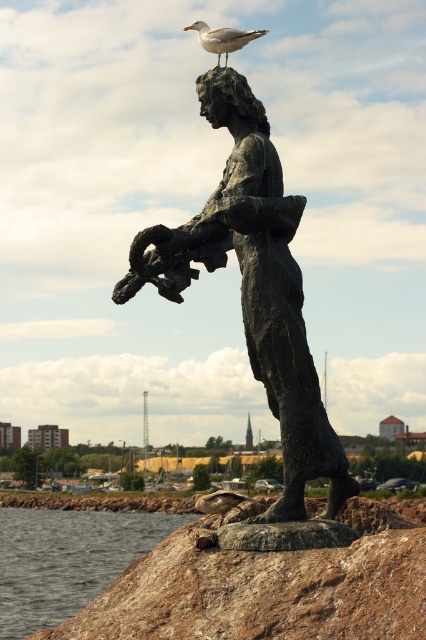
You are standing in front of the bronze statue near the waterfront. You notice two points marked on the statue. The first point is at coordinate point (141, 250) and the second is at point (218, 38). If you were to touch both points with your finger, which point would require your hand to move less distance towards the statue?

Point (141, 250) is closer to the camera than point (218, 38), so touching point (141, 250) would require your hand to move less distance towards the statue.

You are a photographer trying to capture the bronze statue at center and the white feathered seagull at upper center in a single shot. Based on their heights, which object should you focus on first to ensure both are in frame?

Since the bronze statue at center is shorter than the white feathered seagull at upper center, you should focus on the bronze statue at center first to ensure both are in frame, as it requires less vertical adjustment.